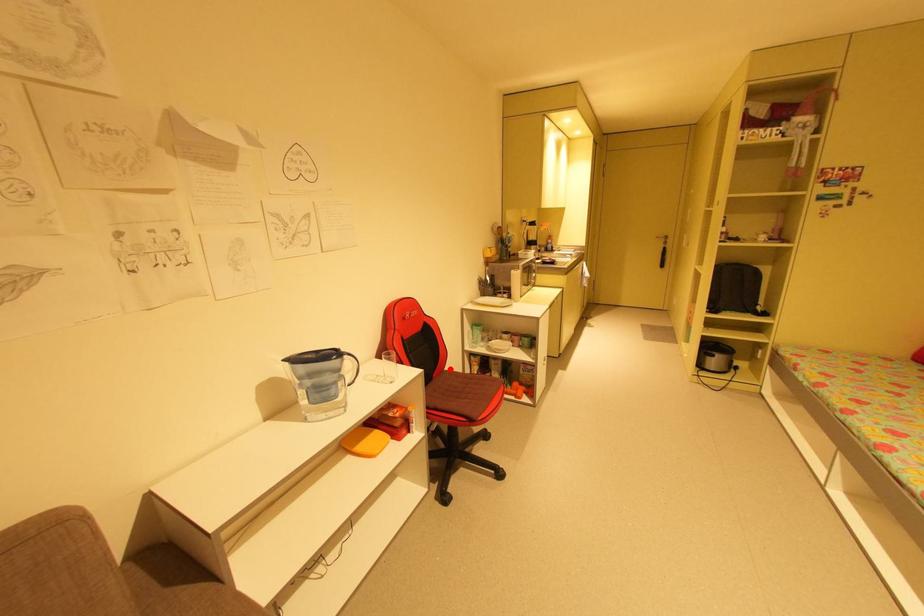
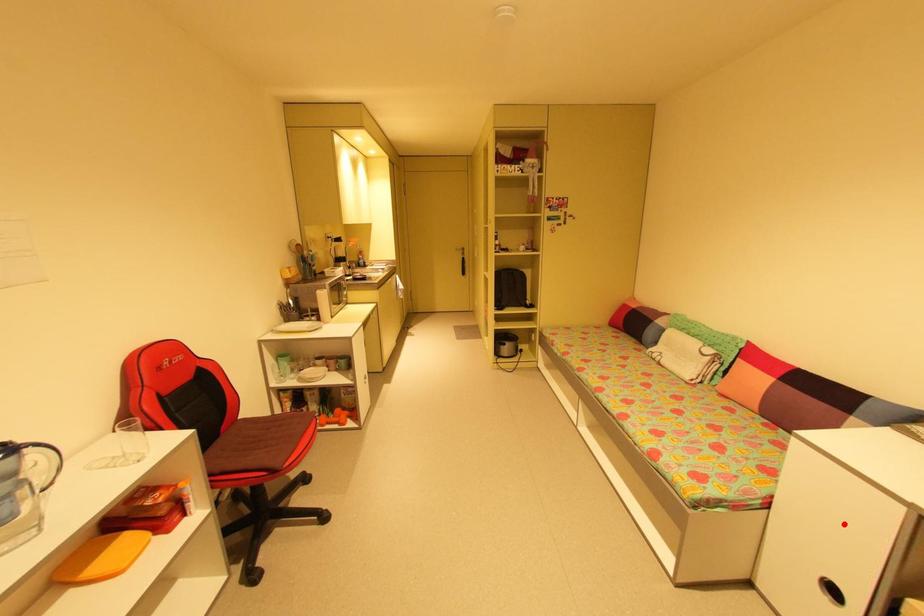
I am providing you with two images of the same scene from different viewpoints. A red point is marked on the first image and another point is marked on the second image. Is the marked point in image1 the same physical position as the marked point in image2?

No